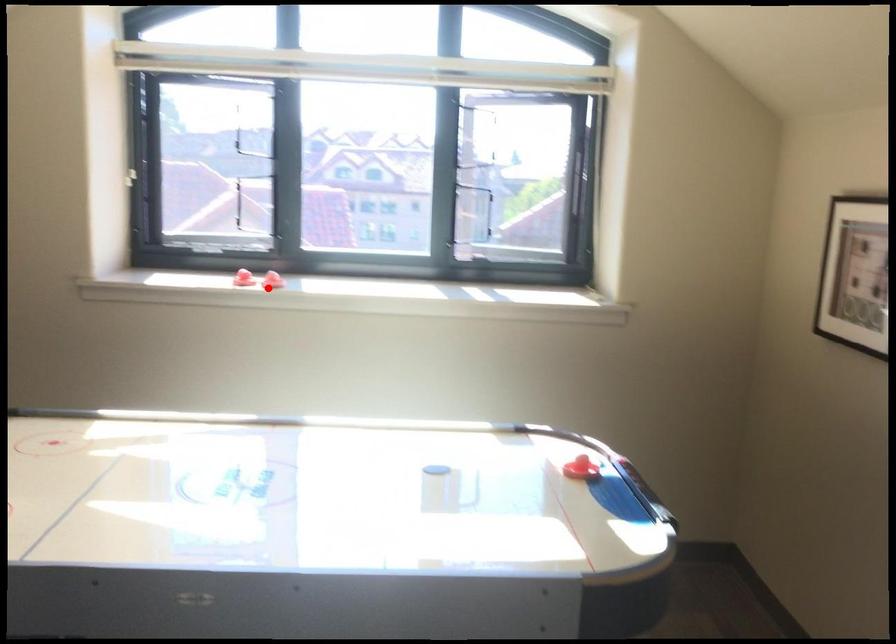
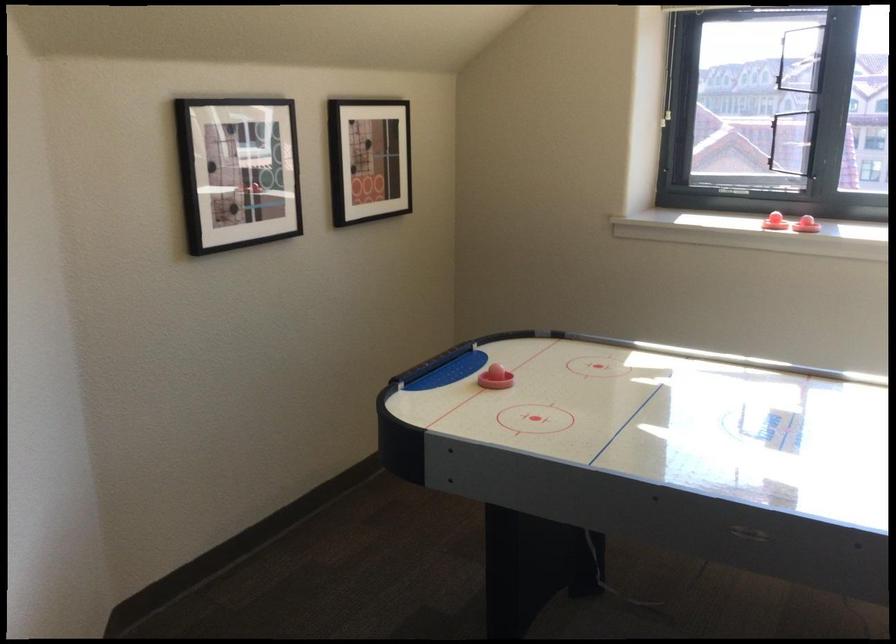
Find the pixel in the second image that matches the highlighted location in the first image.

(806, 225)